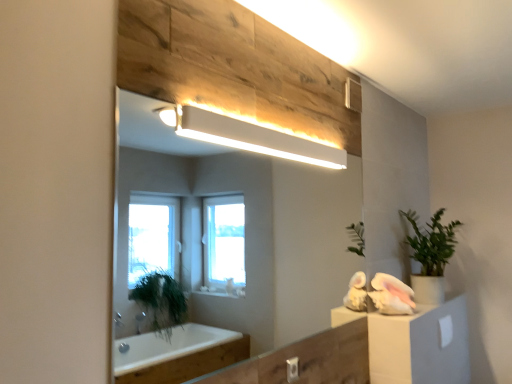
Question: Considering the positions of green matte plant at right and white matte rectangular light fixture at upper center in the image, is green matte plant at right wider or thinner than white matte rectangular light fixture at upper center?

Choices:
 (A) thin
 (B) wide

Answer: (B)

Question: Considering the positions of point (419, 299) and point (305, 157), is point (419, 299) closer or farther from the camera than point (305, 157)?

Choices:
 (A) farther
 (B) closer

Answer: (A)

Question: Based on their relative distances, which object is nearer to the white matte rectangular light fixture at upper center?

Choices:
 (A) green matte plant at right
 (B) white glossy mirror at upper center
 (C) white fluffy towel at right

Answer: (C)

Question: Considering the real-world distances, which object is closest to the white matte rectangular light fixture at upper center?

Choices:
 (A) white fluffy towel at right
 (B) green matte plant at right
 (C) white glossy mirror at upper center

Answer: (A)